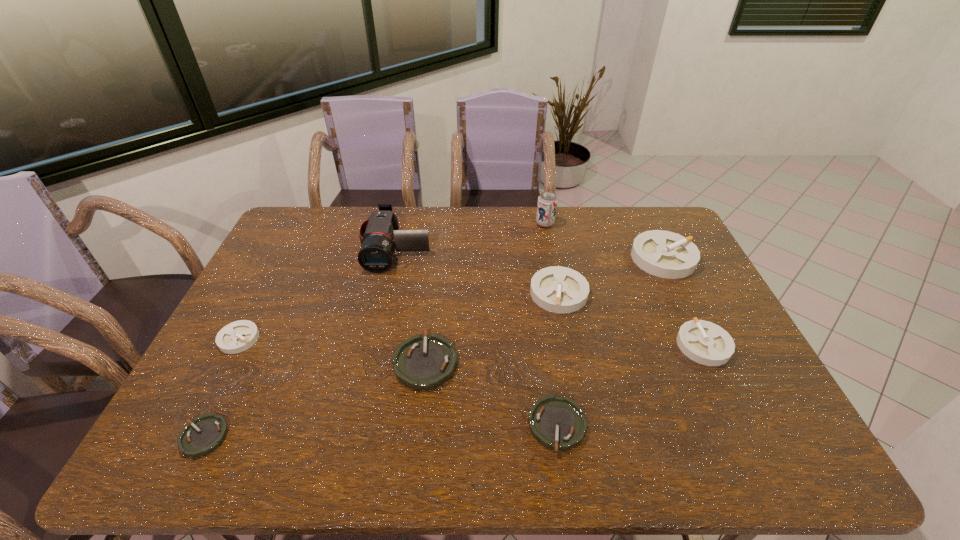
At what (x,y) coordinates should I click in order to perform the action: click on the smallest gray ashtray. Please return your answer as a coordinate pair (x, y). This screenshot has width=960, height=540. Looking at the image, I should click on (238, 336).

Where is `the rightmost green ashtray`? This screenshot has width=960, height=540. the rightmost green ashtray is located at coordinates (558, 423).

What are the coordinates of `the shortest ashtray` in the screenshot? It's located at (207, 432).

At what (x,y) coordinates should I click in order to perform the action: click on the leftmost green ashtray. Please return your answer as a coordinate pair (x, y). This screenshot has height=540, width=960. Looking at the image, I should click on (207, 432).

Identify the location of free location located on the right of the beer can. (605, 224).

At what (x,y) coordinates should I click in order to perform the action: click on free point located on the lens of the camcorder. Please return your answer as a coordinate pair (x, y). Looking at the image, I should click on (377, 335).

The height and width of the screenshot is (540, 960). I want to click on vacant space located on the front of the biggest gray ashtray, so click(x=700, y=333).

Identify the location of vacant area situated 0.310m on the back of the third gray ashtray from right to left. The image size is (960, 540). (545, 220).

Identify the location of vacant region located on the front of the third biggest gray ashtray. The width and height of the screenshot is (960, 540). (726, 392).

The image size is (960, 540). I want to click on free location located on the right of the second green ashtray from left to right, so click(x=603, y=362).